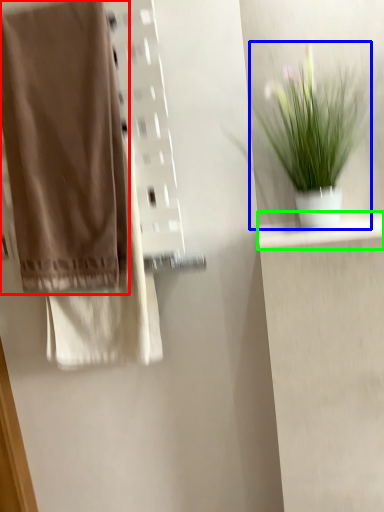
Question: Which is nearer to the towel (highlighted by a red box)? houseplant (highlighted by a blue box) or shelf (highlighted by a green box).

Choices:
 (A) houseplant
 (B) shelf

Answer: (A)